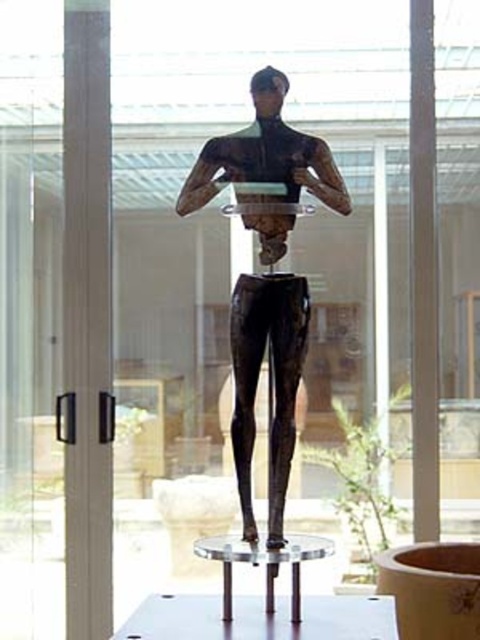
You are an art curator planning to install a new light fixture above the bronze statue at center and the white glossy table at center. Which object should the light be placed closer to if it needs to illuminate the one that is closer to the viewer?

The light should be placed closer to the bronze statue at center because it is closer to the viewer than the white glossy table at center.

You are a security guard in the gallery and need to check the distance between you and the bronze statue at center. If your reach is 2 meters, can you touch the statue without moving closer?

The bronze statue at center is 2.26 meters away from the viewer. Since your reach is 2 meters, you cannot touch the statue without moving closer.

You are a visitor in the museum and want to place a small sculpture on the white glossy table at center. However, there is a green leafy plant at lower center above it. Is there enough space to place the sculpture on the table without the plant blocking it?

The white glossy table at center is positioned under the green leafy plant at lower center, so placing the sculpture on the table might be possible, but the plant could block access or visibility. Ensure there is enough space around the plant to place the sculpture safely.